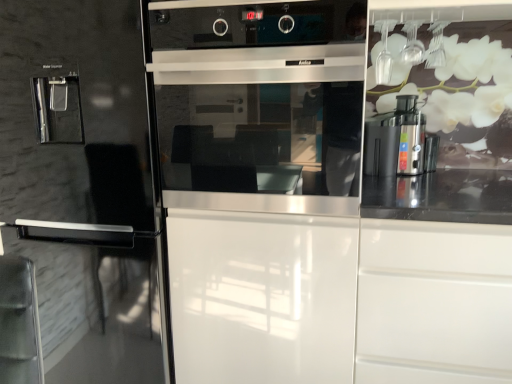
The width and height of the screenshot is (512, 384). What do you see at coordinates (399, 142) in the screenshot?
I see `satin silver coffee machine at right` at bounding box center [399, 142].

I want to click on glossy black fridge at left, so click(81, 99).

Between glossy black fridge at left and satin silver oven at center, which one appears on the left side from the viewer's perspective?

glossy black fridge at left.

Is glossy black fridge at left far away from satin silver oven at center?

No, glossy black fridge at left is not far from satin silver oven at center.

From the image's perspective, is glossy black fridge at left positioned above or below satin silver oven at center?

Based on their image positions, glossy black fridge at left is located beneath satin silver oven at center.

In the scene shown: Considering the sizes of satin silver coffee machine at right and white glossy drawer at right in the image, is satin silver coffee machine at right bigger or smaller than white glossy drawer at right?

Clearly, satin silver coffee machine at right is smaller in size than white glossy drawer at right.

From the picture: Is satin silver coffee machine at right far from white glossy drawer at right?

That's not correct — satin silver coffee machine at right is a little close to white glossy drawer at right.

Does satin silver coffee machine at right turn towards white glossy drawer at right?

No, satin silver coffee machine at right is not turned towards white glossy drawer at right.

Identify the location of drawer lying below the satin silver coffee machine at right (from the image's perspective). The width and height of the screenshot is (512, 384). (434, 303).

Is white glossy drawer at right beside satin silver oven at center?

No.

Is satin silver oven at center surrounded by white glossy drawer at right?

That's incorrect, satin silver oven at center is not inside white glossy drawer at right.

Based on their sizes in the image, would you say white glossy drawer at right is bigger or smaller than satin silver oven at center?

Clearly, white glossy drawer at right is larger in size than satin silver oven at center.

Considering the sizes of white glossy drawer at right and satin silver oven at center in the image, is white glossy drawer at right wider or thinner than satin silver oven at center?

In the image, white glossy drawer at right appears to be wider than satin silver oven at center.

Which is in front, white glossy drawer at right or satin silver coffee machine at right?

white glossy drawer at right is more forward.

Which of these two, white glossy drawer at right or satin silver coffee machine at right, stands taller?

Standing taller between the two is white glossy drawer at right.

Is white glossy drawer at right bigger or smaller than satin silver coffee machine at right?

Considering their sizes, white glossy drawer at right takes up more space than satin silver coffee machine at right.

Is satin silver coffee machine at right positioned with its back to glossy black fridge at left?

satin silver coffee machine at right does not have its back to glossy black fridge at left.

Locate an element on the screen. The width and height of the screenshot is (512, 384). coffee machine that is behind the glossy black fridge at left is located at coordinates (399, 142).

Which object is further away from the camera taking this photo, satin silver coffee machine at right or glossy black fridge at left?

satin silver coffee machine at right is further from the camera.

Does satin silver coffee machine at right have a lesser width compared to glossy black fridge at left?

Yes, satin silver coffee machine at right is thinner than glossy black fridge at left.

Is satin silver coffee machine at right at the back of satin silver oven at center?

satin silver oven at center is not turned away from satin silver coffee machine at right.

How many degrees apart are the facing directions of satin silver oven at center and satin silver coffee machine at right?

0.444 degrees.

Based on the photo, which of these two, satin silver oven at center or satin silver coffee machine at right, stands taller?

satin silver oven at center.

From a real-world perspective, is satin silver oven at center physically located above or below satin silver coffee machine at right?

From a real-world perspective, satin silver oven at center is physically above satin silver coffee machine at right.

Can you confirm if satin silver coffee machine at right is positioned to the right of satin silver oven at center?

Correct, you'll find satin silver coffee machine at right to the right of satin silver oven at center.

Is point (376, 168) closer or farther from the camera than point (184, 18)?

Point (376, 168) is positioned farther from the camera compared to point (184, 18).

Who is smaller, satin silver coffee machine at right or satin silver oven at center?

Smaller between the two is satin silver coffee machine at right.

I want to click on home appliance that appears in front of the satin silver coffee machine at right, so click(255, 101).

This screenshot has width=512, height=384. In order to click on home appliance that is above the glossy black fridge at left (from a real-world perspective) in this screenshot , I will do `click(255, 101)`.

Identify the location of coffee machine on the left of the white glossy drawer at right. This screenshot has width=512, height=384. (399, 142).

From the image, which object appears to be nearer to satin silver oven at center, glossy black fridge at left or white glossy drawer at right?

The object closer to satin silver oven at center is glossy black fridge at left.

Which object lies nearer to the anchor point white glossy drawer at right, satin silver oven at center or glossy black fridge at left?

satin silver oven at center is closer to white glossy drawer at right.

Based on their spatial positions, is glossy black fridge at left or satin silver oven at center further from satin silver coffee machine at right?

Among the two, glossy black fridge at left is located further to satin silver coffee machine at right.

Considering their positions, is satin silver coffee machine at right positioned closer to satin silver oven at center than white glossy drawer at right?

Among the two, white glossy drawer at right is located nearer to satin silver oven at center.

In the scene shown: Estimate the real-world distances between objects in this image. Which object is further from satin silver oven at center, white glossy drawer at right or glossy black fridge at left?

Based on the image, white glossy drawer at right appears to be further to satin silver oven at center.

Looking at this image, from the image, which object appears to be nearer to satin silver oven at center, glossy black fridge at left or satin silver coffee machine at right?

glossy black fridge at left is positioned closer to the anchor satin silver oven at center.

When comparing their distances from glossy black fridge at left, does satin silver oven at center or white glossy drawer at right seem further?

white glossy drawer at right.

Which object lies further to the anchor point white glossy drawer at right, satin silver coffee machine at right or glossy black fridge at left?

glossy black fridge at left is positioned further to the anchor white glossy drawer at right.

Image resolution: width=512 pixels, height=384 pixels. I want to click on coffee machine between satin silver oven at center and white glossy drawer at right in the up-down direction, so click(399, 142).

Find the location of a particular element. This screenshot has width=512, height=384. home appliance between glossy black fridge at left and white glossy drawer at right is located at coordinates (255, 101).

I want to click on coffee machine located between glossy black fridge at left and white glossy drawer at right in the left-right direction, so click(399, 142).

Where is `home appliance situated between glossy black fridge at left and satin silver coffee machine at right from left to right`? The width and height of the screenshot is (512, 384). home appliance situated between glossy black fridge at left and satin silver coffee machine at right from left to right is located at coordinates (255, 101).